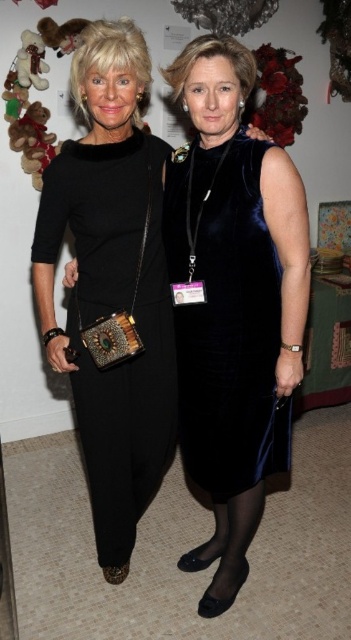
You are a photographer setting up for a group photo. You notice two women wearing velvet dresses in the scene. The first is wearing a black velvet dress at left, and the second is wearing a velvet dark blue dress at center. Which woman should you adjust your camera focus on first to ensure both are in sharp focus?

You should focus on the velvet dark blue dress at center first because the black velvet dress at left is closer to the viewer, so adjusting focus starting from the farther object ensures both are in sharp focus.

You are attending a formal event and need to decide which dress to wear. You see the black velvet dress at left and the velvet dark blue dress at center in the image. Based on their positions in the image, which dress is positioned lower?

The black velvet dress at left is below the velvet dark blue dress at center, so the black velvet dress at left is positioned lower.